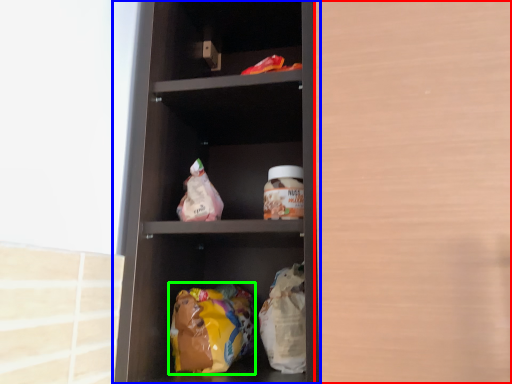
Question: Estimate the real-world distances between objects in this image. Which object is closer to glass door (highlighted by a red box), shelf (highlighted by a blue box) or food (highlighted by a green box)?

Choices:
 (A) shelf
 (B) food

Answer: (A)